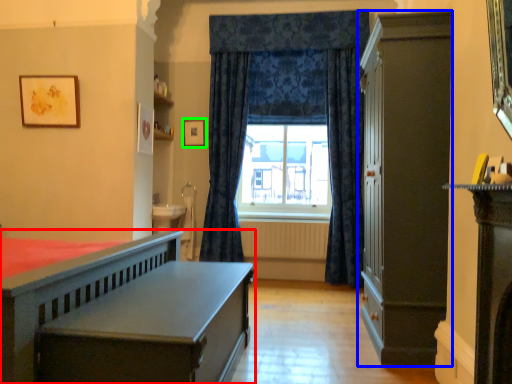
Question: Estimate the real-world distances between objects in this image. Which object is farther from bed (highlighted by a red box), cabinetry (highlighted by a blue box) or picture frame (highlighted by a green box)?

Choices:
 (A) cabinetry
 (B) picture frame

Answer: (B)